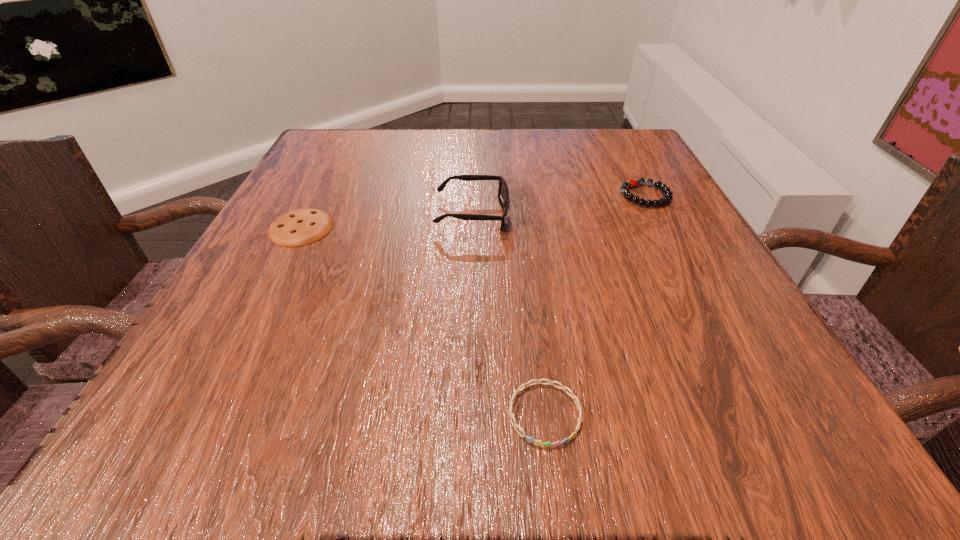
The image size is (960, 540). I want to click on empty location between the tallest object and the rightmost object, so click(559, 205).

Locate an element on the screen. This screenshot has height=540, width=960. empty space that is in between the cookie and the right bracelet is located at coordinates (473, 212).

I want to click on empty location between the right bracelet and the tallest object, so click(x=559, y=205).

Find the location of a particular element. This screenshot has width=960, height=540. unoccupied position between the nearer bracelet and the cookie is located at coordinates (423, 321).

Where is `empty space between the taller bracelet and the nearest object`? empty space between the taller bracelet and the nearest object is located at coordinates (595, 305).

You are a GUI agent. You are given a task and a screenshot of the screen. Output one action in this format:
    pyautogui.click(x=<x>, y=<y>)
    Task: Click on the free space that is in between the left bracelet and the cookie
    Image resolution: width=960 pixels, height=540 pixels.
    Given the screenshot: What is the action you would take?
    pyautogui.click(x=423, y=321)

You are a GUI agent. You are given a task and a screenshot of the screen. Output one action in this format:
    pyautogui.click(x=<x>, y=<y>)
    Task: Click on the free spot between the second tallest object and the nearest object
    The width and height of the screenshot is (960, 540).
    Given the screenshot: What is the action you would take?
    pyautogui.click(x=595, y=305)

This screenshot has width=960, height=540. What are the coordinates of `blank region between the third shortest object and the leftmost object` in the screenshot? It's located at (473, 212).

Identify the location of object that can be found as the third closest to the cookie. This screenshot has height=540, width=960. (667, 198).

Choose which object is the nearest neighbor to the farther bracelet. Please provide its 2D coordinates. Your answer should be formatted as a tuple, i.e. [(x, y)], where the tuple contains the x and y coordinates of a point satisfying the conditions above.

[(503, 193)]